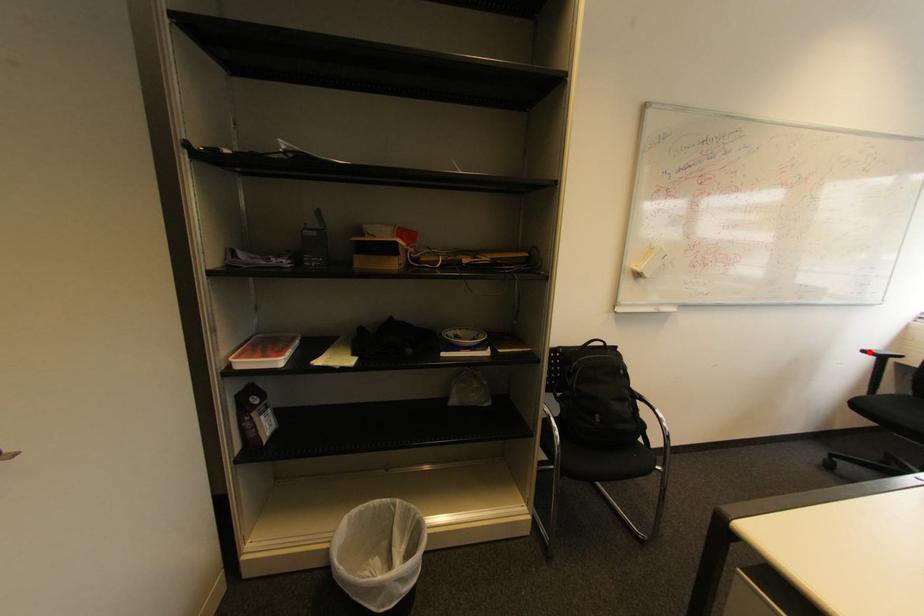
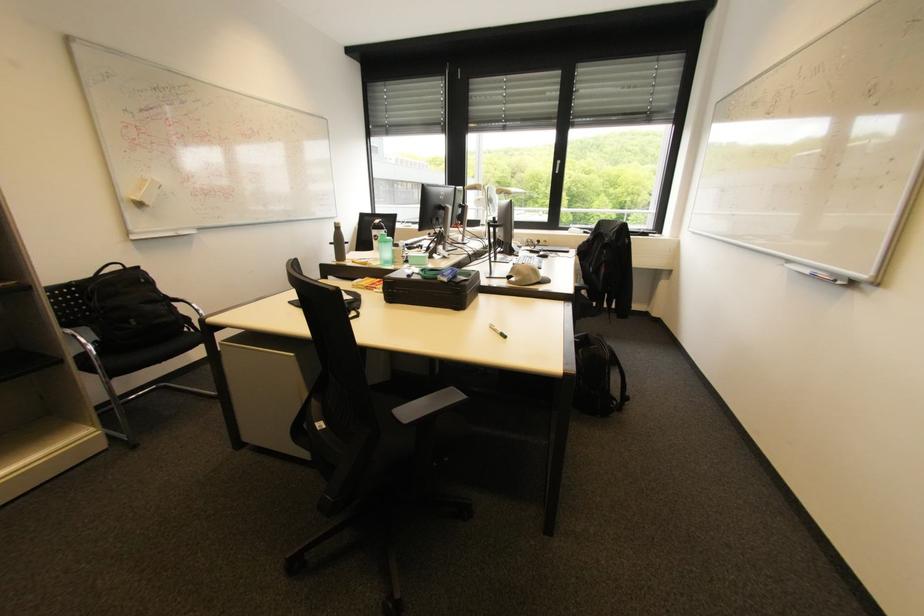
Question: I am providing you with two images of the same scene from different viewpoints. Image1 has a red point marked. In image2, the corresponding 3D location appears at what relative position? Reply with the corresponding letter.

Choices:
 (A) Closer
 (B) Farther

Answer: (A)